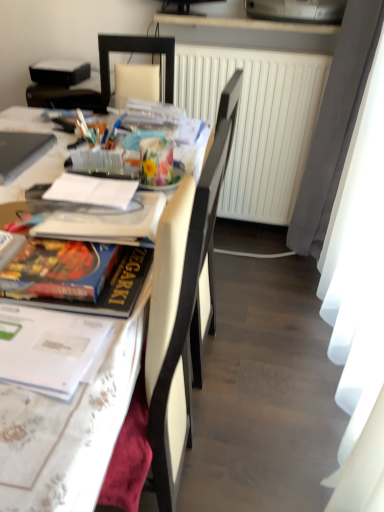
Where is `empty space that is ontop of hardcover book at left, which ranks as the 3th magazine in back-to-front order (from a real-world perspective)`? Image resolution: width=384 pixels, height=512 pixels. empty space that is ontop of hardcover book at left, which ranks as the 3th magazine in back-to-front order (from a real-world perspective) is located at coordinates (59, 259).